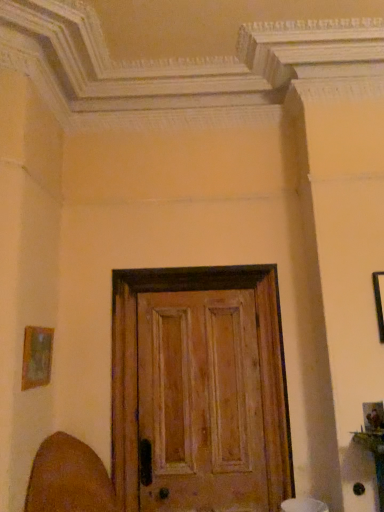
What are the coordinates of `brown leather swivel chair at lower left` in the screenshot? It's located at (68, 478).

The height and width of the screenshot is (512, 384). What are the coordinates of `wooden door at center` in the screenshot? It's located at (132, 373).

The width and height of the screenshot is (384, 512). In order to click on black matte picture frame at upper right, the 2th picture frame positioned from the left in this screenshot , I will do `click(379, 301)`.

Considering the sizes of objects black matte picture frame at upper right, the first picture frame from the right, and wooden door at center in the image provided, who is wider, black matte picture frame at upper right, the first picture frame from the right, or wooden door at center?

wooden door at center is wider.

Is wooden door at center surrounded by black matte picture frame at upper right, the 2th picture frame positioned from the left?

No, wooden door at center is not inside black matte picture frame at upper right, the 2th picture frame positioned from the left.

Is black matte picture frame at upper right, the 2th picture frame positioned from the left, facing towards wooden frame at left, acting as the second picture frame starting from the right?

No, black matte picture frame at upper right, the 2th picture frame positioned from the left, is not facing towards wooden frame at left, acting as the second picture frame starting from the right.

From a real-world perspective, is black matte picture frame at upper right, the first picture frame from the right, beneath wooden frame at left, the first picture frame positioned from the left?

No, from a real-world perspective, black matte picture frame at upper right, the first picture frame from the right, is not below wooden frame at left, the first picture frame positioned from the left.

Looking at their sizes, would you say black matte picture frame at upper right, the 2th picture frame positioned from the left, is wider or thinner than wooden frame at left, the first picture frame positioned from the left?

black matte picture frame at upper right, the 2th picture frame positioned from the left, is wider than wooden frame at left, the first picture frame positioned from the left.

Could wooden frame at left, the first picture frame positioned from the left, be considered to be inside wooden door at center?

That's incorrect, wooden frame at left, the first picture frame positioned from the left, is not inside wooden door at center.

Does wooden door at center have a larger size compared to wooden frame at left, the first picture frame positioned from the left?

Yes.

Consider the image. From a real-world perspective, is wooden door at center located beneath wooden frame at left, acting as the second picture frame starting from the right?

Correct, in the physical world, wooden door at center is lower than wooden frame at left, acting as the second picture frame starting from the right.

Locate an element on the screen. The height and width of the screenshot is (512, 384). door that is below the wooden frame at left, acting as the second picture frame starting from the right (from the image's perspective) is located at coordinates (132, 373).

From a real-world perspective, who is located lower, brown leather swivel chair at lower left or black matte picture frame at upper right, the first picture frame from the right?

brown leather swivel chair at lower left.

Is brown leather swivel chair at lower left facing towards black matte picture frame at upper right, the 2th picture frame positioned from the left?

No, brown leather swivel chair at lower left is not oriented towards black matte picture frame at upper right, the 2th picture frame positioned from the left.

Which of these two, brown leather swivel chair at lower left or black matte picture frame at upper right, the 2th picture frame positioned from the left, is smaller?

black matte picture frame at upper right, the 2th picture frame positioned from the left.

Looking at their sizes, would you say brown leather swivel chair at lower left is wider or thinner than wooden door at center?

In the image, brown leather swivel chair at lower left appears to be wider than wooden door at center.

Consider the image. Is brown leather swivel chair at lower left spatially inside wooden door at center, or outside of it?

The correct answer is: outside.

Is brown leather swivel chair at lower left positioned with its back to wooden door at center?

No, brown leather swivel chair at lower left is not facing the opposite direction of wooden door at center.

Locate an element on the screen. swivel chair on the left of the wooden door at center is located at coordinates (68, 478).

Locate an element on the screen. The height and width of the screenshot is (512, 384). swivel chair in front of the wooden door at center is located at coordinates (68, 478).

Is brown leather swivel chair at lower left located within wooden door at center?

No.

From the image's perspective, is wooden door at center above or below brown leather swivel chair at lower left?

From the image's perspective, wooden door at center appears above brown leather swivel chair at lower left.

Consider the image. Is black matte picture frame at upper right, the first picture frame from the right, with brown leather swivel chair at lower left?

They are not placed beside each other.

From the image's perspective, is black matte picture frame at upper right, the 2th picture frame positioned from the left, on top of brown leather swivel chair at lower left?

Yes, from the image's perspective, black matte picture frame at upper right, the 2th picture frame positioned from the left, is on top of brown leather swivel chair at lower left.

Between point (375, 287) and point (49, 461), which one is positioned behind?

Positioned behind is point (375, 287).

In the scene shown: From a real-world perspective, is black matte picture frame at upper right, the 2th picture frame positioned from the left, physically above brown leather swivel chair at lower left?

Correct, in the physical world, black matte picture frame at upper right, the 2th picture frame positioned from the left, is higher than brown leather swivel chair at lower left.

You are a GUI agent. You are given a task and a screenshot of the screen. Output one action in this format:
    pyautogui.click(x=<x>, y=<y>)
    Task: Click on the door to the left of black matte picture frame at upper right, the 2th picture frame positioned from the left
    This screenshot has height=512, width=384.
    Given the screenshot: What is the action you would take?
    pyautogui.click(x=132, y=373)

Locate an element on the screen. The width and height of the screenshot is (384, 512). picture frame above the wooden frame at left, the first picture frame positioned from the left (from a real-world perspective) is located at coordinates (379, 301).

Looking at the image, which one is located further to wooden frame at left, acting as the second picture frame starting from the right, wooden door at center or black matte picture frame at upper right, the 2th picture frame positioned from the left?

The object further to wooden frame at left, acting as the second picture frame starting from the right, is black matte picture frame at upper right, the 2th picture frame positioned from the left.

Considering their positions, is black matte picture frame at upper right, the first picture frame from the right, positioned closer to wooden door at center than wooden frame at left, the first picture frame positioned from the left?

Based on the image, wooden frame at left, the first picture frame positioned from the left, appears to be nearer to wooden door at center.

From the image, which object appears to be nearer to brown leather swivel chair at lower left, black matte picture frame at upper right, the first picture frame from the right, or wooden frame at left, the first picture frame positioned from the left?

wooden frame at left, the first picture frame positioned from the left, is closer to brown leather swivel chair at lower left.

In the scene shown: Estimate the real-world distances between objects in this image. Which object is closer to black matte picture frame at upper right, the first picture frame from the right, wooden door at center or wooden frame at left, acting as the second picture frame starting from the right?

wooden door at center.

Considering their positions, is wooden frame at left, acting as the second picture frame starting from the right, positioned closer to wooden door at center than black matte picture frame at upper right, the 2th picture frame positioned from the left?

wooden frame at left, acting as the second picture frame starting from the right.

Looking at the image, which one is located further to black matte picture frame at upper right, the first picture frame from the right, brown leather swivel chair at lower left or wooden door at center?

Based on the image, brown leather swivel chair at lower left appears to be further to black matte picture frame at upper right, the first picture frame from the right.

From the picture: Estimate the real-world distances between objects in this image. Which object is closer to black matte picture frame at upper right, the first picture frame from the right, wooden frame at left, the first picture frame positioned from the left, or wooden door at center?

wooden door at center is positioned closer to the anchor black matte picture frame at upper right, the first picture frame from the right.

When comparing their distances from wooden door at center, does brown leather swivel chair at lower left or wooden frame at left, acting as the second picture frame starting from the right, seem closer?

brown leather swivel chair at lower left.

Find the location of a particular element. This screenshot has height=512, width=384. door between wooden frame at left, the first picture frame positioned from the left, and black matte picture frame at upper right, the 2th picture frame positioned from the left, in the horizontal direction is located at coordinates (132, 373).

The width and height of the screenshot is (384, 512). What are the coordinates of `door between brown leather swivel chair at lower left and black matte picture frame at upper right, the first picture frame from the right` in the screenshot? It's located at (132, 373).

Where is `swivel chair between wooden frame at left, the first picture frame positioned from the left, and wooden door at center from left to right`? This screenshot has width=384, height=512. swivel chair between wooden frame at left, the first picture frame positioned from the left, and wooden door at center from left to right is located at coordinates (68, 478).

Identify the location of swivel chair situated between wooden frame at left, the first picture frame positioned from the left, and black matte picture frame at upper right, the first picture frame from the right, from left to right. This screenshot has width=384, height=512. (68, 478).